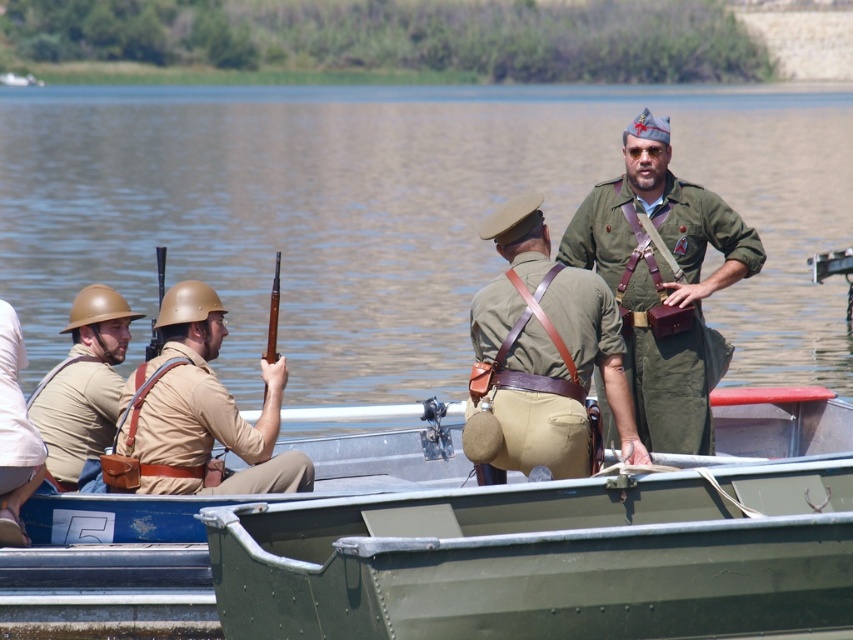
Measure the distance between green water at center and matte olive-green uniform at center.

green water at center is 44.59 meters away from matte olive-green uniform at center.

Does green water at center have a lesser height compared to matte olive-green uniform at center?

In fact, green water at center may be taller than matte olive-green uniform at center.

The height and width of the screenshot is (640, 853). I want to click on green water at center, so click(397, 214).

Is matte olive-green uniform at center below tan leather uniform at left?

Incorrect, matte olive-green uniform at center is not positioned below tan leather uniform at left.

Can you confirm if matte olive-green uniform at center is thinner than tan leather uniform at left?

Indeed, matte olive-green uniform at center has a lesser width compared to tan leather uniform at left.

You are a GUI agent. You are given a task and a screenshot of the screen. Output one action in this format:
    pyautogui.click(x=<x>, y=<y>)
    Task: Click on the matte olive-green uniform at center
    
    Given the screenshot: What is the action you would take?
    pyautogui.click(x=544, y=349)

Find the location of `matte olive-green uniform at center`. matte olive-green uniform at center is located at coordinates (544, 349).

Can you confirm if green water at center is smaller than green metal boat at center?

Incorrect, green water at center is not smaller in size than green metal boat at center.

Does point (334, 205) come in front of point (505, 506)?

No, it is behind (505, 506).

Is point (798, 168) behind point (810, 413)?

Yes, point (798, 168) is behind point (810, 413).

You are a GUI agent. You are given a task and a screenshot of the screen. Output one action in this format:
    pyautogui.click(x=<x>, y=<y>)
    Task: Click on the green water at center
    
    Given the screenshot: What is the action you would take?
    pyautogui.click(x=397, y=214)